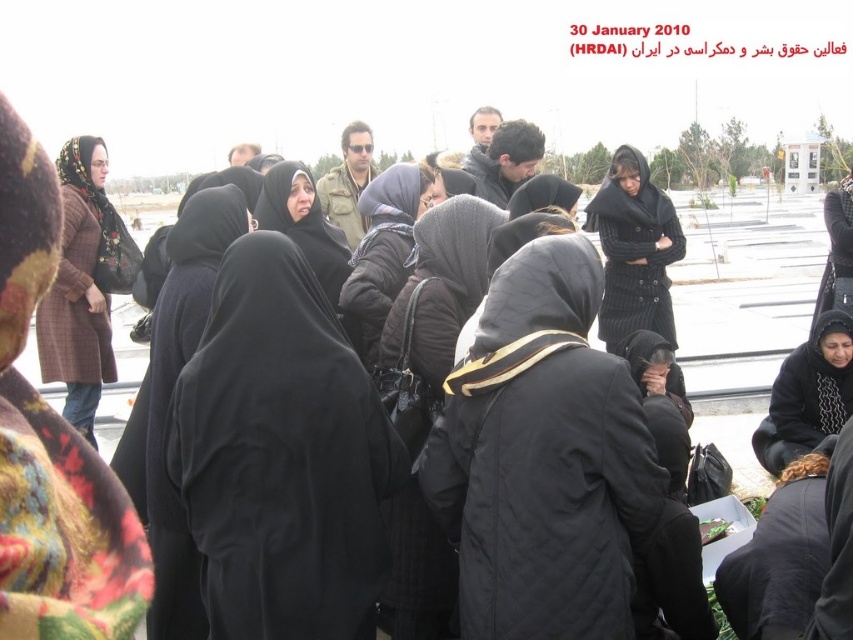
You are standing in the parking lot and see the black quilted jacket at center. If you walk straight towards it, how far will you have to walk to reach it?

You will have to walk 71.21 feet to reach the black quilted jacket at center.

Consider the image. You are a photographer trying to capture the black knitted sweater at center and the black fabric headscarf at center in the same frame. Based on their positions, can you determine which one is closer to the camera?

The black knitted sweater at center is above the black fabric headscarf at center, so the headscarf is closer to the camera since it is positioned lower in the image.